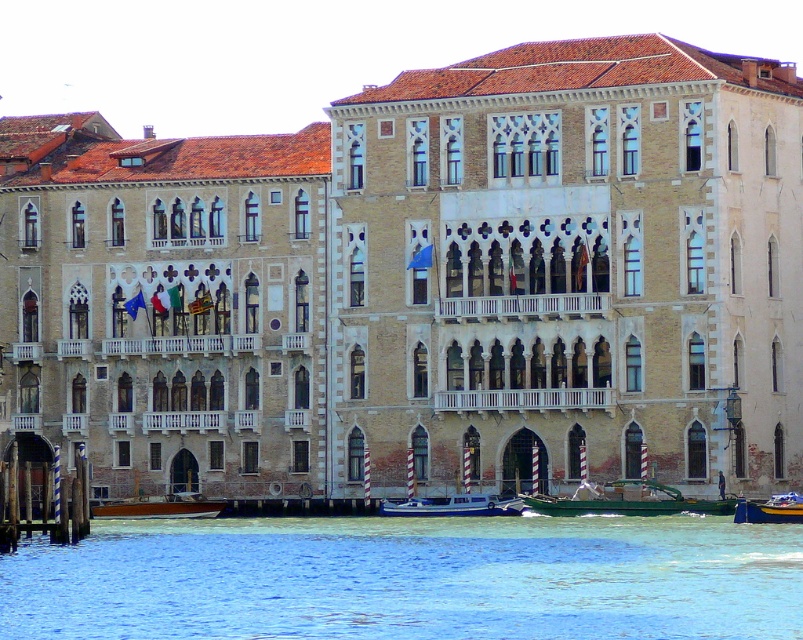
Consider the image. Is clear blue water at lower center to the left of white glossy boat at center from the viewer's perspective?

In fact, clear blue water at lower center is to the right of white glossy boat at center.

Who is positioned more to the right, clear blue water at lower center or white glossy boat at center?

clear blue water at lower center

From the picture: Who is more distant from viewer, (712,588) or (450,515)?

Positioned behind is point (450,515).

Where is `clear blue water at lower center`? The image size is (803, 640). clear blue water at lower center is located at coordinates (410, 579).

Measure the distance between clear blue water at lower center and camera.

They are 43.79 meters apart.

Which is above, clear blue water at lower center or wooden polished boat at lower left?

clear blue water at lower center is above.

The height and width of the screenshot is (640, 803). What do you see at coordinates (410, 579) in the screenshot?
I see `clear blue water at lower center` at bounding box center [410, 579].

You are a GUI agent. You are given a task and a screenshot of the screen. Output one action in this format:
    pyautogui.click(x=<x>, y=<y>)
    Task: Click on the clear blue water at lower center
    This screenshot has width=803, height=640.
    Given the screenshot: What is the action you would take?
    pyautogui.click(x=410, y=579)

Between white glossy boat at center and metallic blue boat at lower right, which one is positioned lower?

white glossy boat at center

Does white glossy boat at center appear under metallic blue boat at lower right?

Indeed, white glossy boat at center is positioned under metallic blue boat at lower right.

Between point (477, 509) and point (775, 522), which one is positioned in front?

Positioned in front is point (775, 522).

The image size is (803, 640). Find the location of `white glossy boat at center`. white glossy boat at center is located at coordinates (453, 506).